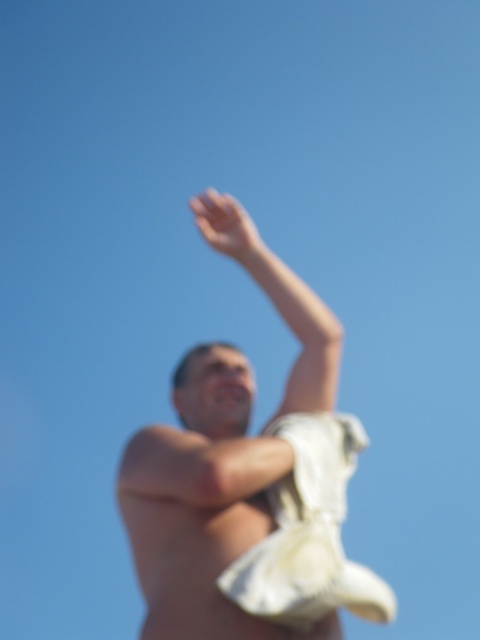
Based on the photo, you are a photographer trying to capture a clear image of the smooth white arm at upper center. However, the white cloth at upper center is blocking your view. Can you adjust your position to see the arm without the cloth obscuring it?

The white cloth at upper center is in front of the smooth white arm at upper center, so adjusting your position might allow you to see around or behind the cloth to view the arm.

You are a photographer trying to capture the white cloth at upper center and the smooth white arm at upper center in a clear photo. Which object is shorter and needs to be positioned closer to the camera to ensure it appears in focus alongside the taller object?

The white cloth at upper center is not as tall as the smooth white arm at upper center, so the white cloth at upper center is shorter and should be positioned closer to the camera to ensure both appear in focus.

You are a photographer trying to capture the scene. You notice the white cloth at upper center and the smooth white arm at upper center in your viewfinder. Which object appears narrower in the image?

The white cloth at upper center appears narrower than the smooth white arm at upper center because it has a lesser width compared to the smooth white arm at upper center.